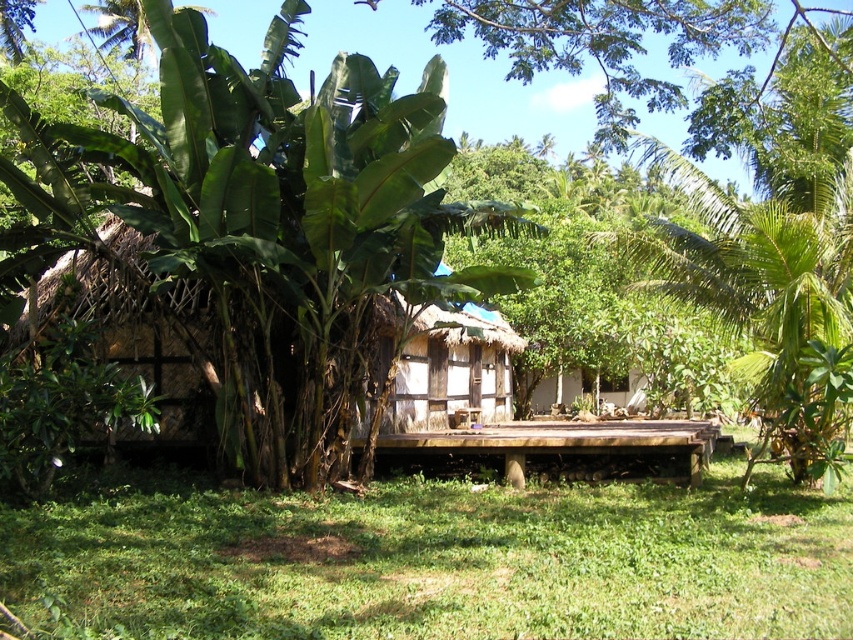
You are standing at the entrance of the rustic wooden hut and want to walk to the green grass at center. Which direction should you move relative to the hut?

The green grass at center is located at coordinates (438, 561) in the image, so you should move forward from the entrance of the rustic wooden hut to reach the green grass at center.

Consider the image. You are standing in the tropical setting and want to know which object is taller between the green grass at center and the green leafy banana tree at center. Can you determine which one is taller?

The green leafy banana tree at center is taller than the green grass at center according to the description provided.